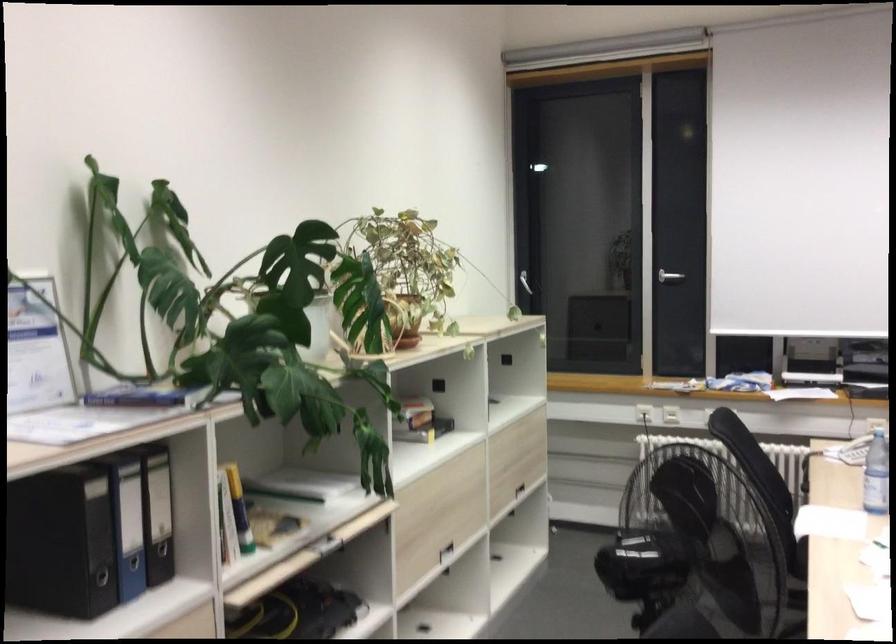
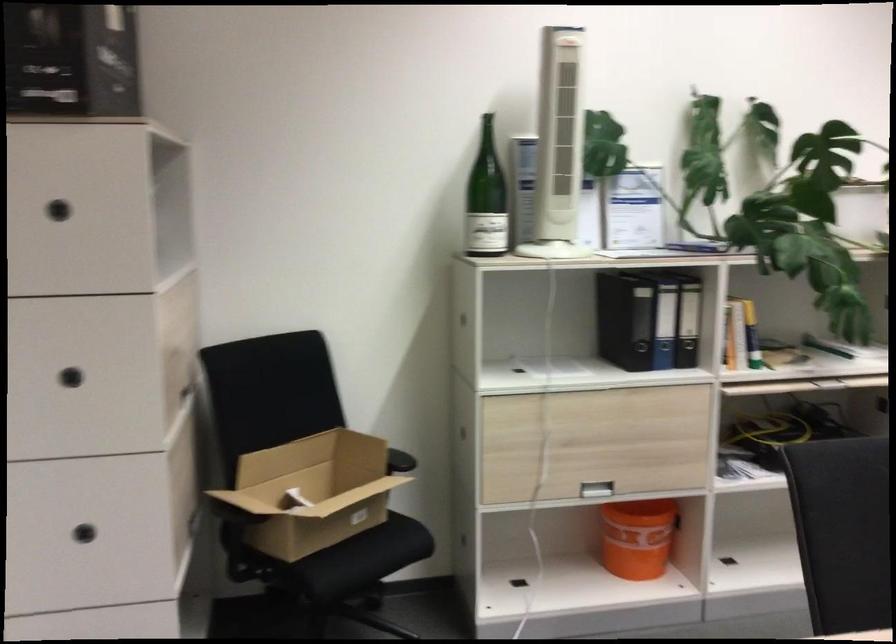
In the second image, find the point that corresponds to [128,536] in the first image.

(664, 325)